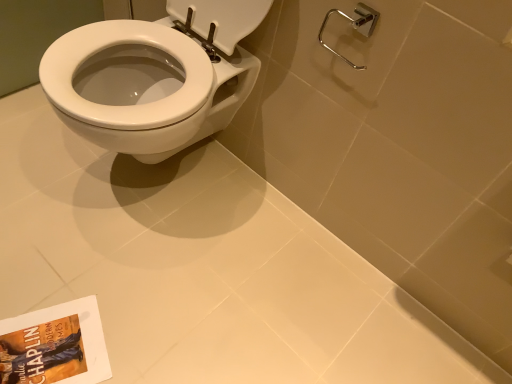
Identify the location of empty space that is ontop of matte paper book at lower left (from a real-world perspective). This screenshot has height=384, width=512. (42, 345).